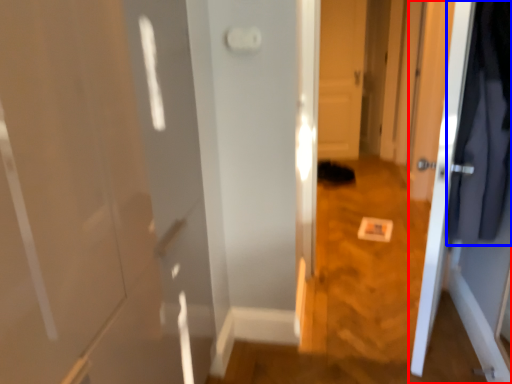
Question: Which object appears farthest to the camera in this image, door (highlighted by a red box) or clothing (highlighted by a blue box)?

Choices:
 (A) door
 (B) clothing

Answer: (A)